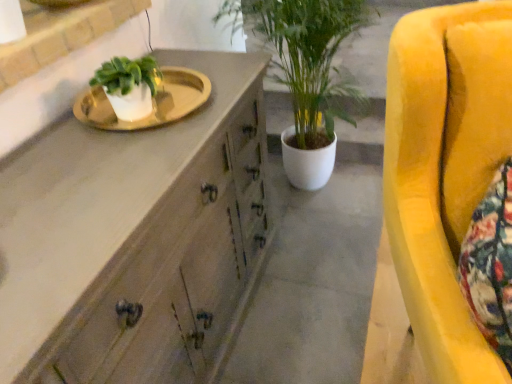
Question: Is concreteroughcabinet at center in contact with wooden cabinet at center?

Choices:
 (A) no
 (B) yes

Answer: (A)

Question: Is wooden cabinet at center completely or partially inside concreteroughcabinet at center?

Choices:
 (A) no
 (B) yes

Answer: (A)

Question: From the image's perspective, is concreteroughcabinet at center on wooden cabinet at center?

Choices:
 (A) no
 (B) yes

Answer: (A)

Question: Does concreteroughcabinet at center have a larger size compared to wooden cabinet at center?

Choices:
 (A) yes
 (B) no

Answer: (B)

Question: From a real-world perspective, is concreteroughcabinet at center located higher than wooden cabinet at center?

Choices:
 (A) no
 (B) yes

Answer: (A)

Question: In terms of width, does concreteroughcabinet at center look wider or thinner when compared to wooden cabinet at center?

Choices:
 (A) wide
 (B) thin

Answer: (A)

Question: From the image's perspective, is concreteroughcabinet at center above or below wooden cabinet at center?

Choices:
 (A) above
 (B) below

Answer: (B)

Question: Based on their sizes in the image, would you say concreteroughcabinet at center is bigger or smaller than wooden cabinet at center?

Choices:
 (A) small
 (B) big

Answer: (A)

Question: Is concreteroughcabinet at center inside or outside of wooden cabinet at center?

Choices:
 (A) outside
 (B) inside

Answer: (A)

Question: From a real-world perspective, relative to white glossy sink at upper left, is concreteroughcabinet at center vertically above or below?

Choices:
 (A) above
 (B) below

Answer: (B)

Question: Do you think concreteroughcabinet at center is within white glossy sink at upper left, or outside of it?

Choices:
 (A) outside
 (B) inside

Answer: (A)

Question: From the image's perspective, relative to white glossy sink at upper left, is concreteroughcabinet at center above or below?

Choices:
 (A) below
 (B) above

Answer: (A)

Question: From their relative heights in the image, would you say concreteroughcabinet at center is taller or shorter than white glossy sink at upper left?

Choices:
 (A) tall
 (B) short

Answer: (B)

Question: Do you think wooden cabinet at center is within white glossy sink at upper left, or outside of it?

Choices:
 (A) inside
 (B) outside

Answer: (B)

Question: Considering the positions of point (256, 64) and point (98, 100), is point (256, 64) closer or farther from the camera than point (98, 100)?

Choices:
 (A) farther
 (B) closer

Answer: (A)